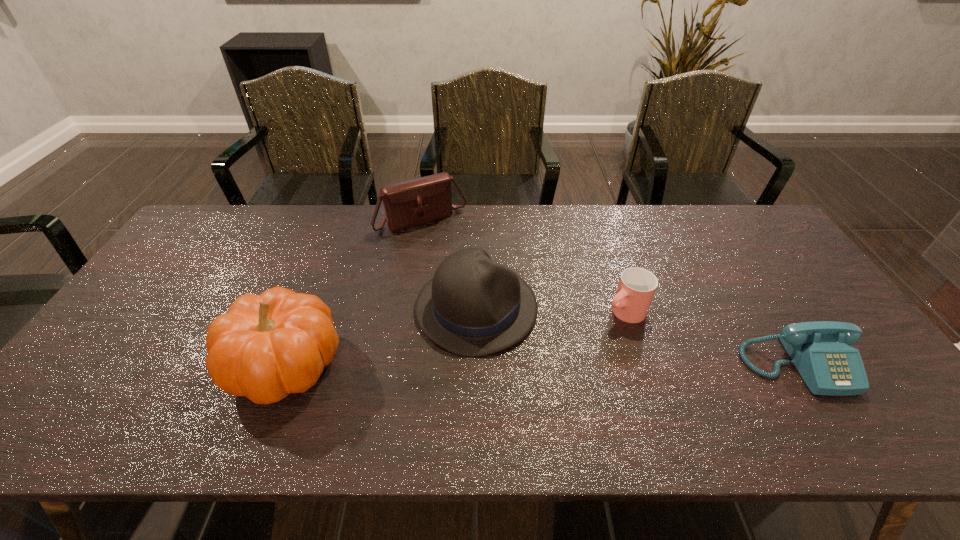
Where is `pumpkin`? This screenshot has height=540, width=960. pumpkin is located at coordinates (266, 346).

Where is `telephone`? telephone is located at coordinates 820,350.

This screenshot has width=960, height=540. In order to click on the shortest object in this screenshot , I will do `click(820, 350)`.

Identify the location of the fourth object from left to right. (636, 288).

The height and width of the screenshot is (540, 960). I want to click on bowler hat, so click(473, 306).

Identify the location of the farthest object. (417, 201).

Where is `vacant area located 0.180m on the left of the tallest object`? vacant area located 0.180m on the left of the tallest object is located at coordinates pos(154,364).

Image resolution: width=960 pixels, height=540 pixels. What are the coordinates of `free region located on the side of the cup with the handle` in the screenshot? It's located at (584, 338).

Locate an element on the screen. The image size is (960, 540). blank space located 0.340m on the side of the cup with the handle is located at coordinates pyautogui.click(x=513, y=386).

The image size is (960, 540). What are the coordinates of `free region located on the side of the cup with the handle` in the screenshot? It's located at (503, 392).